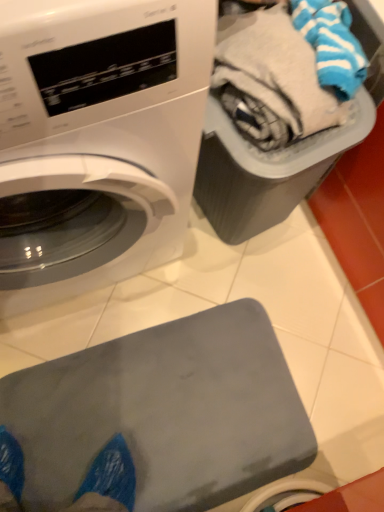
Question: Is point (122, 408) positioned closer to the camera than point (23, 309)?

Choices:
 (A) farther
 (B) closer

Answer: (B)

Question: Is gray rubber mat at lower center in front of or behind white glossy washing machine at upper left in the image?

Choices:
 (A) behind
 (B) front

Answer: (A)

Question: Estimate the real-world distances between objects in this image. Which object is closer to the gray rubber mat at lower center?

Choices:
 (A) plastic gray bin at upper right
 (B) white glossy washing machine at upper left

Answer: (B)

Question: Considering the real-world distances, which object is farthest from the plastic gray bin at upper right?

Choices:
 (A) white glossy washing machine at upper left
 (B) gray rubber mat at lower center

Answer: (B)